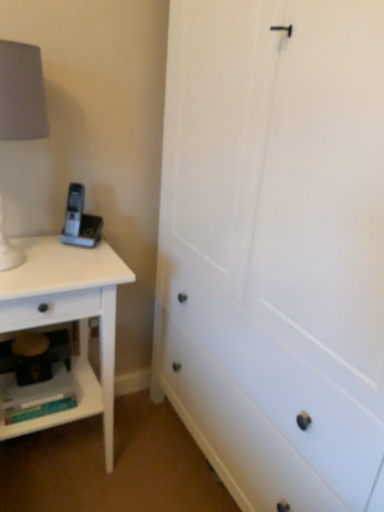
I want to click on free point above white matte nightstand at left (from a real-world perspective), so click(x=48, y=257).